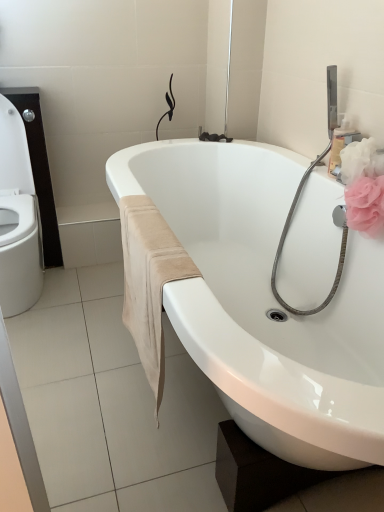
Question: From a real-world perspective, is pink fabric flower at upper right located higher than black rubber faucet at upper center?

Choices:
 (A) yes
 (B) no

Answer: (B)

Question: Is pink fabric flower at upper right at the right side of black rubber faucet at upper center?

Choices:
 (A) no
 (B) yes

Answer: (B)

Question: Considering the relative sizes of pink fabric flower at upper right and black rubber faucet at upper center in the image provided, is pink fabric flower at upper right smaller than black rubber faucet at upper center?

Choices:
 (A) yes
 (B) no

Answer: (B)

Question: Does pink fabric flower at upper right have a lesser width compared to black rubber faucet at upper center?

Choices:
 (A) yes
 (B) no

Answer: (B)

Question: Is pink fabric flower at upper right positioned with its back to black rubber faucet at upper center?

Choices:
 (A) yes
 (B) no

Answer: (A)

Question: Is pink fabric flower at upper right at the left side of black rubber faucet at upper center?

Choices:
 (A) no
 (B) yes

Answer: (A)

Question: Is black rubber faucet at upper center at the back of beige suede towel at lower center?

Choices:
 (A) yes
 (B) no

Answer: (B)

Question: From the image's perspective, is beige suede towel at lower center over black rubber faucet at upper center?

Choices:
 (A) yes
 (B) no

Answer: (B)

Question: Can you confirm if beige suede towel at lower center is positioned to the right of black rubber faucet at upper center?

Choices:
 (A) yes
 (B) no

Answer: (B)

Question: Is beige suede towel at lower center facing towards black rubber faucet at upper center?

Choices:
 (A) no
 (B) yes

Answer: (A)

Question: Is beige suede towel at lower center far from black rubber faucet at upper center?

Choices:
 (A) yes
 (B) no

Answer: (A)

Question: Is beige suede towel at lower center outside black rubber faucet at upper center?

Choices:
 (A) yes
 (B) no

Answer: (A)

Question: Could you tell me if black rubber faucet at upper center is turned towards white glossy bathtub at center?

Choices:
 (A) no
 (B) yes

Answer: (A)